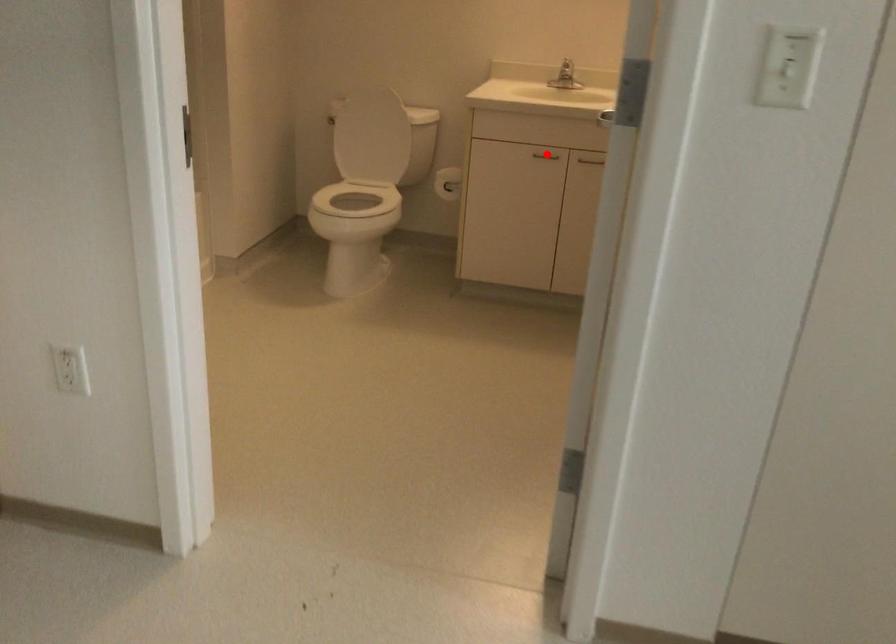
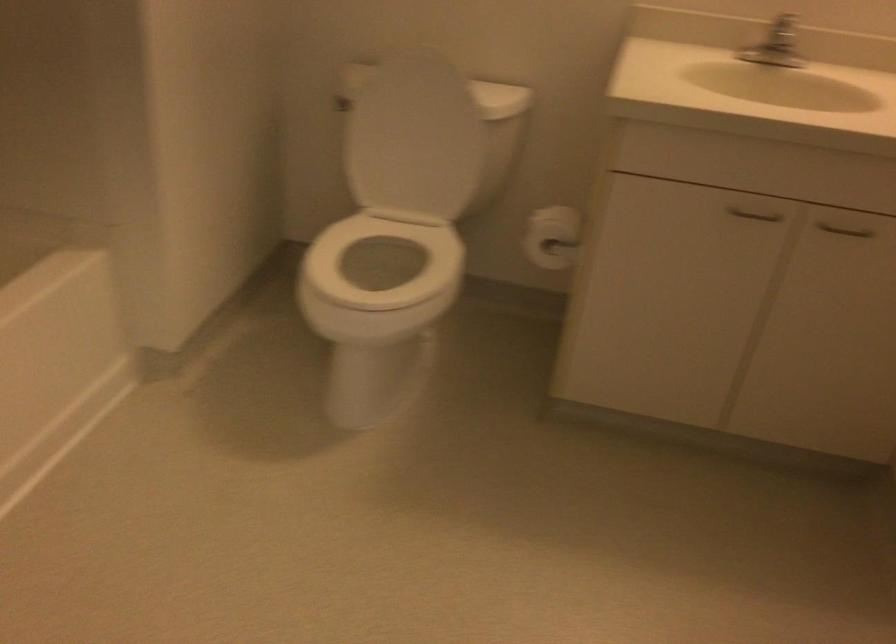
Question: A red point is marked in image1. In image2, is the corresponding 3D point closer to the camera or farther? Reply with the corresponding letter.

Choices:
 (A) The corresponding 3D point is closer.
 (B) The corresponding 3D point is farther.

Answer: (A)